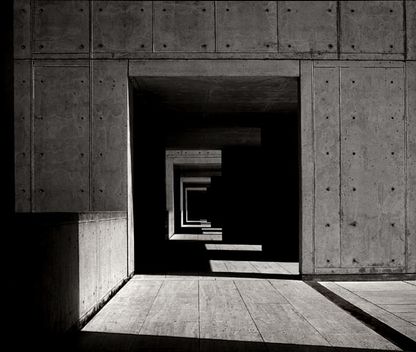
You are a GUI agent. You are given a task and a screenshot of the screen. Output one action in this format:
    pyautogui.click(x=<x>, y=<y>)
    Task: Click on the table
    
    Given the screenshot: What is the action you would take?
    pyautogui.click(x=111, y=235)